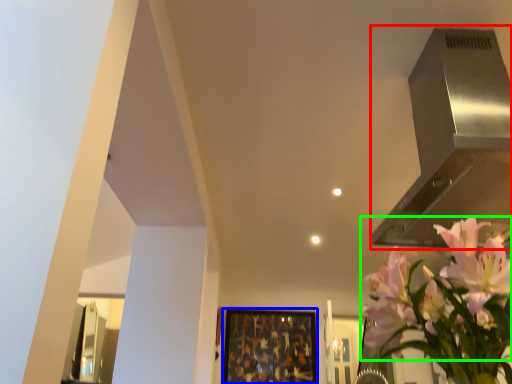
Question: Which is nearer to the vent (highlighted by a red box)? picture frame (highlighted by a blue box) or flower (highlighted by a green box).

Choices:
 (A) picture frame
 (B) flower

Answer: (B)